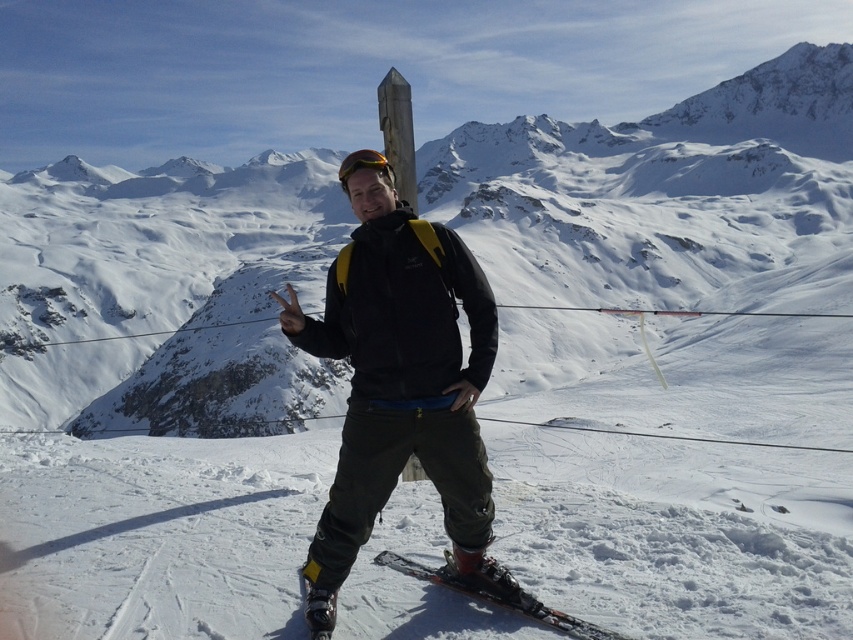
Does snowy mountain at center have a greater height compared to black matte jacket at center?

Correct, snowy mountain at center is much taller as black matte jacket at center.

Does snowy mountain at center lie in front of black matte jacket at center?

That is False.

Describe the element at coordinates (161, 289) in the screenshot. I see `snowy mountain at center` at that location.

Image resolution: width=853 pixels, height=640 pixels. I want to click on snowy mountain at center, so click(161, 289).

Does snowy mountain at center have a greater height compared to shiny black ski at lower center?

Indeed, snowy mountain at center has a greater height compared to shiny black ski at lower center.

Who is more distant from viewer, (659, 145) or (518, 589)?

Positioned behind is point (659, 145).

You are a GUI agent. You are given a task and a screenshot of the screen. Output one action in this format:
    pyautogui.click(x=<x>, y=<y>)
    Task: Click on the snowy mountain at center
    The image size is (853, 640).
    Given the screenshot: What is the action you would take?
    pyautogui.click(x=161, y=289)

Which is below, black matte jacket at center or shiny black ski at lower center?

shiny black ski at lower center is below.

Does black matte jacket at center come in front of shiny black ski at lower center?

No.

Locate an element on the screen. The height and width of the screenshot is (640, 853). black matte jacket at center is located at coordinates (399, 381).

I want to click on black matte jacket at center, so click(x=399, y=381).